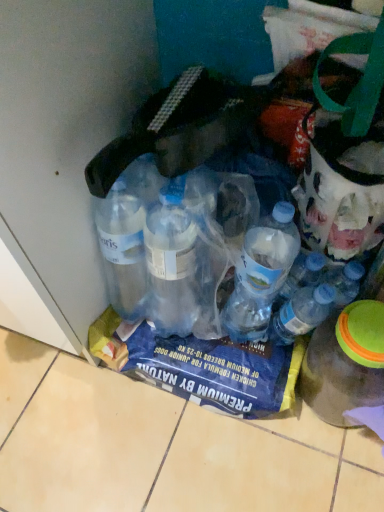
Identify the location of vacant space to the left of translucent plastic bottle at center, placed as the 2th bottle when sorted from left to right. This screenshot has height=512, width=384. (214, 348).